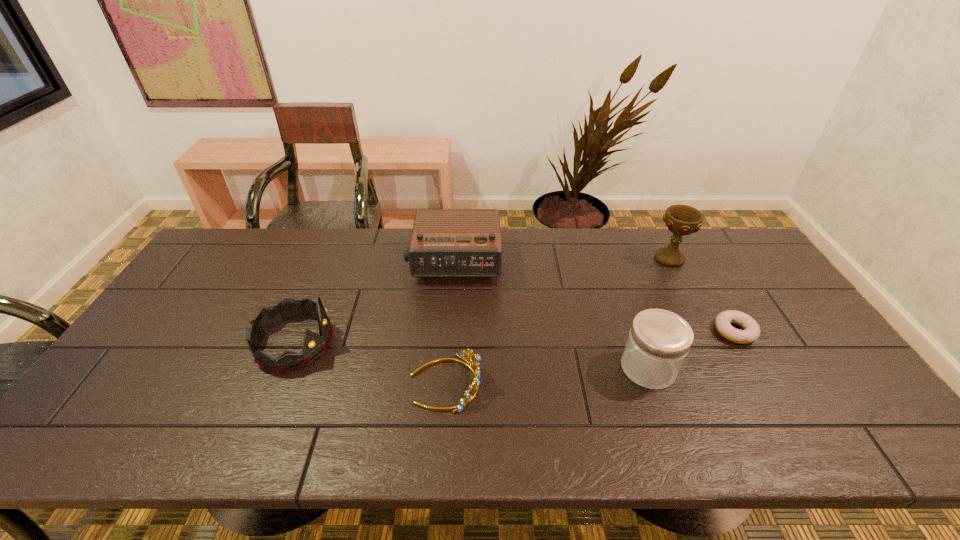
This screenshot has width=960, height=540. Identify the location of unoccupied position between the leftmost object and the fifth tallest object. (370, 363).

Where is `free space between the chalice and the shorter tiara`? The width and height of the screenshot is (960, 540). free space between the chalice and the shorter tiara is located at coordinates (558, 321).

Find the location of `free area in between the shortest object and the leftmost object`. free area in between the shortest object and the leftmost object is located at coordinates [515, 337].

Locate an element on the screen. The width and height of the screenshot is (960, 540). free space between the second shortest object and the chalice is located at coordinates click(558, 321).

Find the location of `unoccupied area between the taller tiara and the shortest object`. unoccupied area between the taller tiara and the shortest object is located at coordinates (515, 337).

Image resolution: width=960 pixels, height=540 pixels. In order to click on empty space that is in between the chalice and the radio receiver in this screenshot , I will do `click(563, 260)`.

I want to click on vacant space that is in between the left tiara and the chalice, so click(x=482, y=301).

At what (x,y) coordinates should I click in order to perform the action: click on vacant area between the chalice and the taller tiara. Please return your answer as a coordinate pair (x, y). The image size is (960, 540). Looking at the image, I should click on (482, 301).

Locate an element on the screen. vacant space in between the radio receiver and the doughnut is located at coordinates (594, 296).

Identify which object is the fifth nearest to the shortest object. Please provide its 2D coordinates. Your answer should be formatted as a tuple, i.e. [(x, y)], where the tuple contains the x and y coordinates of a point satisfying the conditions above.

[(314, 346)]